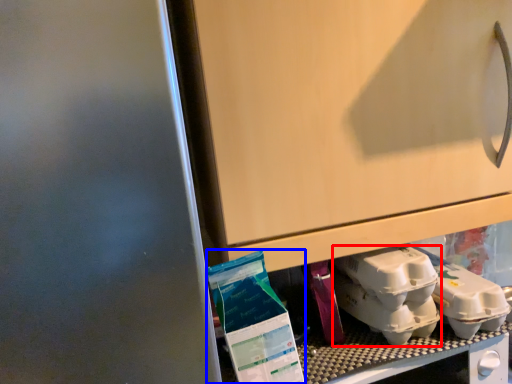
Question: Which of the following is the farthest to the observer, yoghurt (highlighted by a red box) or yoghurt (highlighted by a blue box)?

Choices:
 (A) yoghurt
 (B) yoghurt

Answer: (A)